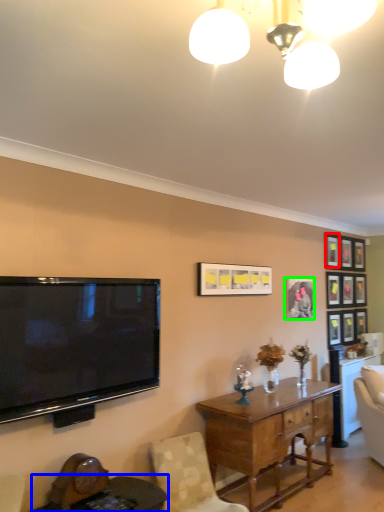
Question: Based on their relative distances, which object is farther from picture frame (highlighted by a red box)? Choose from round table (highlighted by a blue box) and picture frame (highlighted by a green box).

Choices:
 (A) round table
 (B) picture frame

Answer: (A)